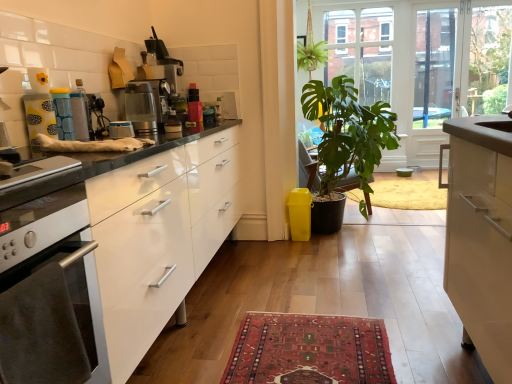
Question: Is brushed metal toaster at center, which appears as the 3th appliance when viewed from the left, far away from transparent glass door at upper center?

Choices:
 (A) yes
 (B) no

Answer: (A)

Question: Is brushed metal toaster at center, which appears as the 3th appliance when viewed from the left, looking in the opposite direction of transparent glass door at upper center?

Choices:
 (A) yes
 (B) no

Answer: (B)

Question: From the image's perspective, is brushed metal toaster at center, which appears as the 3th appliance when viewed from the left, beneath transparent glass door at upper center?

Choices:
 (A) yes
 (B) no

Answer: (A)

Question: Is brushed metal toaster at center, which appears as the 3th appliance when viewed from the left, bigger than transparent glass door at upper center?

Choices:
 (A) yes
 (B) no

Answer: (B)

Question: Does brushed metal toaster at center, which is counted as the 1th appliance, starting from the right, have a lesser width compared to transparent glass door at upper center?

Choices:
 (A) no
 (B) yes

Answer: (B)

Question: From their relative heights in the image, would you say brushed metal toaster at center, which is counted as the 1th appliance, starting from the right, is taller or shorter than metallic silver coffee maker at center?

Choices:
 (A) short
 (B) tall

Answer: (A)

Question: Is brushed metal toaster at center, which appears as the 3th appliance when viewed from the left, in front of or behind metallic silver coffee maker at center in the image?

Choices:
 (A) behind
 (B) front

Answer: (B)

Question: Is point (115, 122) positioned closer to the camera than point (130, 102)?

Choices:
 (A) farther
 (B) closer

Answer: (B)

Question: Would you say brushed metal toaster at center, which is counted as the 1th appliance, starting from the right, is inside or outside metallic silver coffee maker at center?

Choices:
 (A) outside
 (B) inside

Answer: (A)

Question: Is matte yellow container at upper left, arranged as the 1th appliance when viewed from the left, in front of or behind brushed metal toaster at center, which is counted as the 1th appliance, starting from the right, in the image?

Choices:
 (A) behind
 (B) front

Answer: (B)

Question: Considering the positions of matte yellow container at upper left, arranged as the 1th appliance when viewed from the left, and brushed metal toaster at center, which is counted as the 1th appliance, starting from the right, in the image, is matte yellow container at upper left, arranged as the 1th appliance when viewed from the left, taller or shorter than brushed metal toaster at center, which is counted as the 1th appliance, starting from the right,?

Choices:
 (A) tall
 (B) short

Answer: (A)

Question: Considering the positions of matte yellow container at upper left, arranged as the 1th appliance when viewed from the left, and brushed metal toaster at center, which is counted as the 1th appliance, starting from the right, in the image, is matte yellow container at upper left, arranged as the 1th appliance when viewed from the left, bigger or smaller than brushed metal toaster at center, which is counted as the 1th appliance, starting from the right,?

Choices:
 (A) big
 (B) small

Answer: (A)

Question: Is matte yellow container at upper left, arranged as the 1th appliance when viewed from the left, to the left or to the right of brushed metal toaster at center, which is counted as the 1th appliance, starting from the right, in the image?

Choices:
 (A) left
 (B) right

Answer: (A)

Question: From a real-world perspective, relative to matte blue canister at center, which is counted as the second appliance, starting from the left, is clear glass screen door at upper right vertically above or below?

Choices:
 (A) above
 (B) below

Answer: (A)

Question: Considering the relative positions of clear glass screen door at upper right and matte blue canister at center, acting as the 2th appliance starting from the right, in the image provided, is clear glass screen door at upper right to the left or to the right of matte blue canister at center, acting as the 2th appliance starting from the right,?

Choices:
 (A) left
 (B) right

Answer: (B)